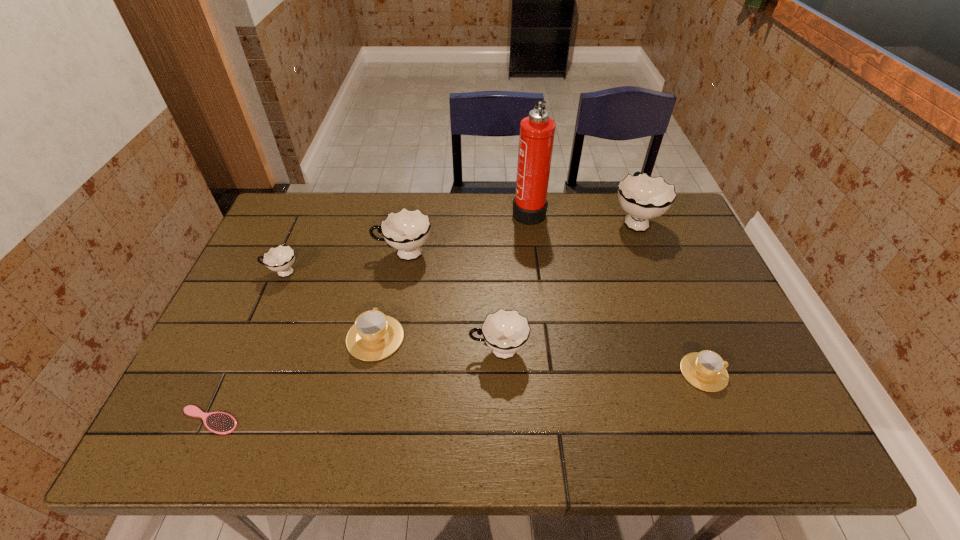
Point out which white cup is positioned as the second nearest to the third white cup from right to left. Please provide its 2D coordinates. Your answer should be formatted as a tuple, i.e. [(x, y)], where the tuple contains the x and y coordinates of a point satisfying the conditions above.

[(505, 331)]

Select which white cup is the second closest to the smaller brown cup. Please provide its 2D coordinates. Your answer should be formatted as a tuple, i.e. [(x, y)], where the tuple contains the x and y coordinates of a point satisfying the conditions above.

[(643, 197)]

Find the location of a particular element. Image resolution: width=960 pixels, height=540 pixels. free space in the image that satisfies the following two spatial constraints: 1. on the side of the fourth tallest object with the handle; 2. on the side of the second tallest object with the handle is located at coordinates (494, 220).

Identify the location of vacant area in the image that satisfies the following two spatial constraints: 1. on the side of the third tallest object with the handle; 2. on the side of the tallest cup with the handle. The height and width of the screenshot is (540, 960). (410, 220).

At what (x,y) coordinates should I click in order to perform the action: click on vacant space that satisfies the following two spatial constraints: 1. on the front-facing side of the fire extinguisher; 2. on the side of the biggest white cup with the handle. Please return your answer as a coordinate pair (x, y). The width and height of the screenshot is (960, 540). Looking at the image, I should click on (530, 220).